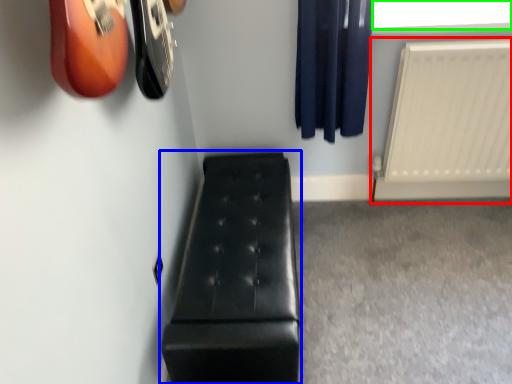
Question: Considering the real-world distances, which object is closest to radiator (highlighted by a red box)? furniture (highlighted by a blue box) or window screen (highlighted by a green box).

Choices:
 (A) furniture
 (B) window screen

Answer: (B)